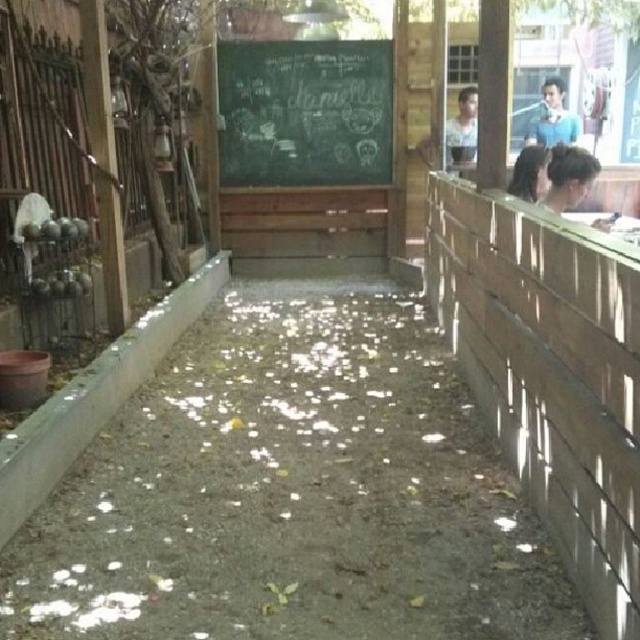
You are a painter standing at the end of the walkway and want to paint both the wooden fence at right and the smooth skin face at upper right. Which object should you focus on first if you want to paint the larger one first?

The wooden fence at right should be painted first since it has a larger size compared to the smooth skin face at upper right.

You are a painter standing at the end of the walkway and want to paint both the wooden fence at right and the smooth skin face at upper right. Which object should you focus on first if you want to paint the taller one first?

The wooden fence at right is taller than the smooth skin face at upper right, so you should focus on painting the wooden fence at right first.

You are standing at the starting point of the walkway and want to reach the end. Which of the two points, point (470, 157) or point (544, 84), is closer to your current position?

Point (470, 157) is closer to your current position because it is in front of point (544, 84) along the walkway.